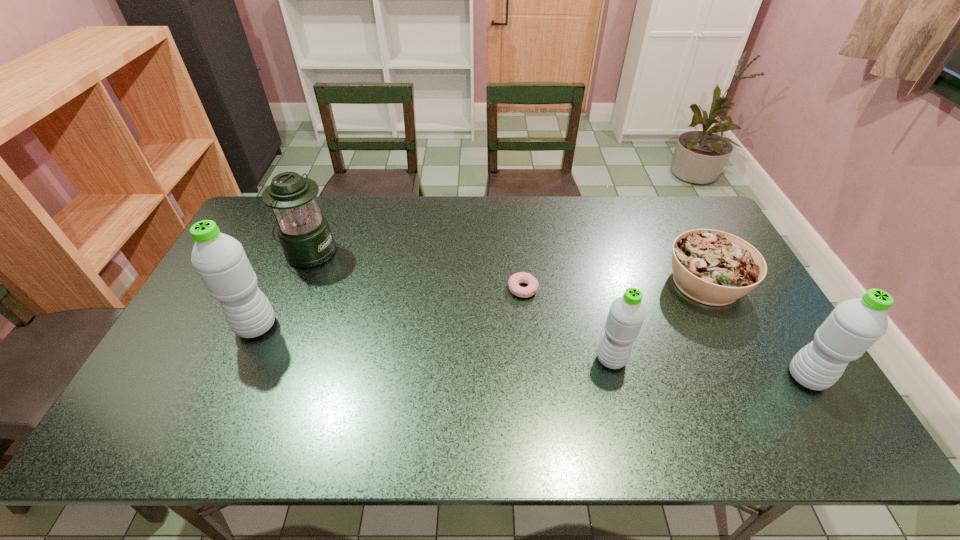
In order to click on free spot that satisfies the following two spatial constraints: 1. on the front side of the second water bottle from left to right; 2. on the right side of the fourth object from right to left in this screenshot , I will do `click(530, 359)`.